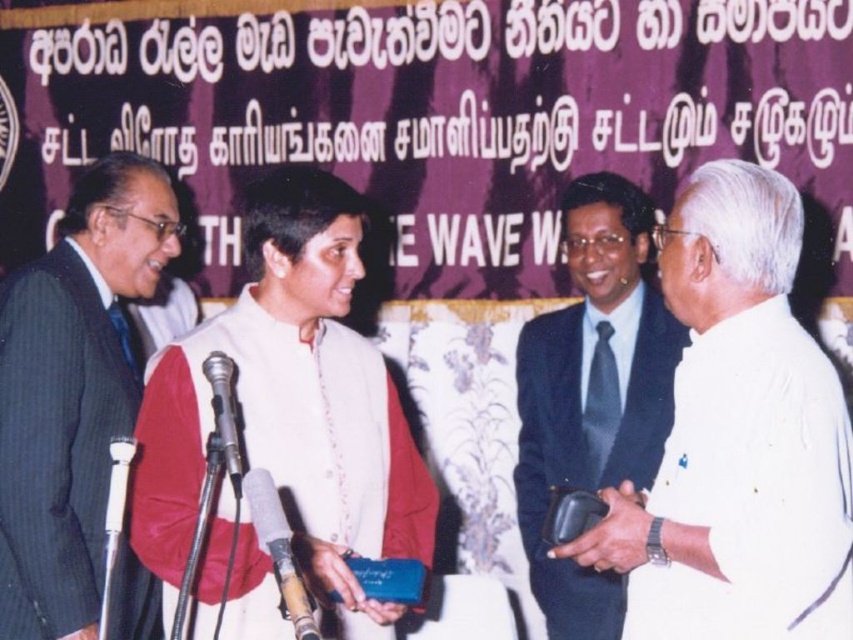
You are an event photographer at this ceremony. You need to capture a photo where the dark blue suit at right and the silver metallic microphone at center are both clearly visible. Based on their positions, which object should be placed on the right side of the photo frame?

The dark blue suit at right should be placed on the right side of the photo frame because it is positioned to the right of the silver metallic microphone at center.

You are organizing a formal event and need to ensure that the white matte shirt at right and the white matte vest at center can fit side by side on a display rack. The rack has a width of 1 meter. Given their sizes, will they fit together?

The white matte shirt at right has a smaller width than the white matte vest at center. Since the total width of both items combined is less than 1 meter, they can fit side by side on the display rack.

You are attending the ceremony and need to locate the dark blue suit at right. Based on the coordinates provided in the scene description, where exactly should you look to find it?

The dark blue suit at right is located at point coordinates 0.614 on the x axis and 0.696 on the y axis.